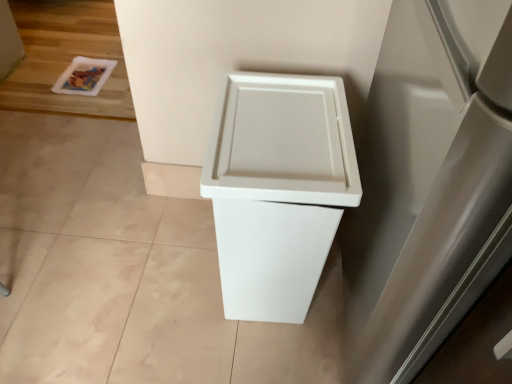
This screenshot has width=512, height=384. In order to click on free space in front of white plastic waste bin at center in this screenshot , I will do `click(250, 356)`.